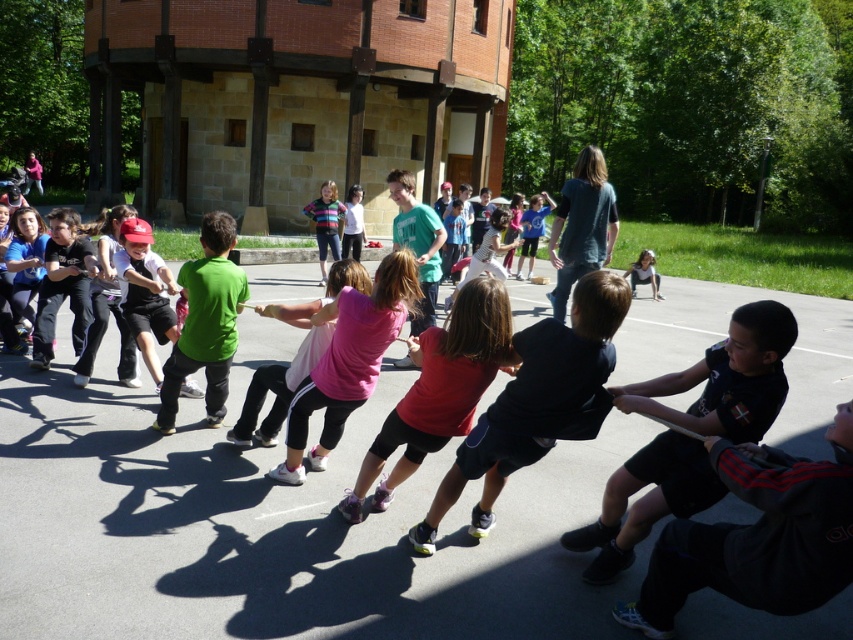
Which is below, green jersey at center or matte black shirt at center?

green jersey at center

Who is taller, green jersey at center or matte black shirt at center?

Standing taller between the two is green jersey at center.

Between point (170, 308) and point (645, 252), which one is positioned in front?

Point (170, 308) is more forward.

Find the location of `green jersey at center`. green jersey at center is located at coordinates coord(144,291).

Looking at this image, who is positioned more to the right, smooth asphalt basketball court at center or green jersey at center?

smooth asphalt basketball court at center

Between smooth asphalt basketball court at center and green jersey at center, which one appears on the left side from the viewer's perspective?

green jersey at center

Is point (94, 488) more distant than point (142, 344)?

No, it is in front of (142, 344).

Find the location of a particular element. This screenshot has height=640, width=853. smooth asphalt basketball court at center is located at coordinates pos(271,522).

How much distance is there between smooth asphalt basketball court at center and matte black shirt at center?

smooth asphalt basketball court at center is 6.38 meters from matte black shirt at center.

Does smooth asphalt basketball court at center have a smaller size compared to matte black shirt at center?

No.

Where is `smooth asphalt basketball court at center`? smooth asphalt basketball court at center is located at coordinates (271, 522).

Locate an element on the screen. The image size is (853, 640). smooth asphalt basketball court at center is located at coordinates (271, 522).